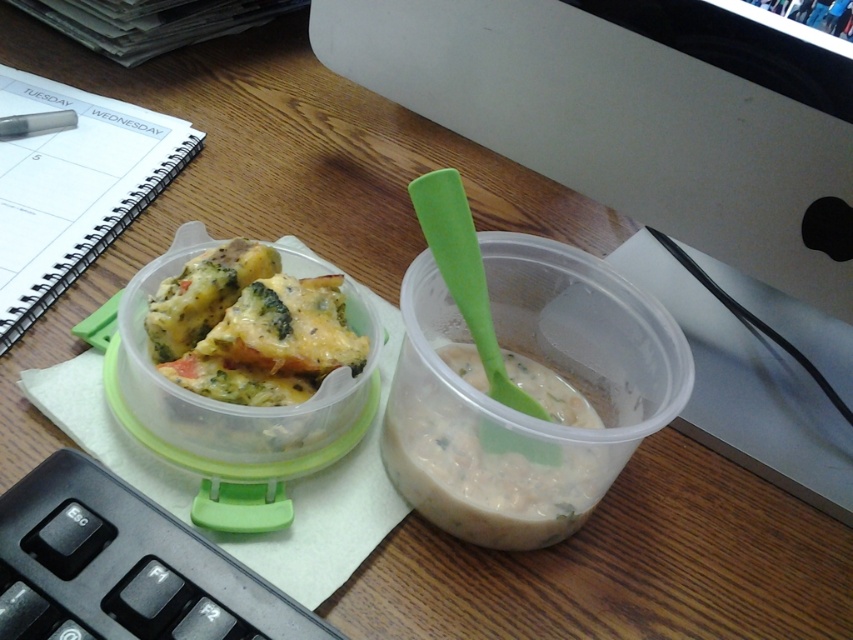
Question: Observing the image, what is the correct spatial positioning of black plastic keyboard at lower left in reference to white creamy soup at center?

Choices:
 (A) left
 (B) right

Answer: (A)

Question: Estimate the real-world distances between objects in this image. Which object is farther from the black plastic keyboard at lower left?

Choices:
 (A) white creamy soup at center
 (B) metallic silver pen at upper left
 (C) cheesy broccoli casserole at left

Answer: (B)

Question: Which object is closer to the camera taking this photo?

Choices:
 (A) metallic silver pen at upper left
 (B) black plastic keyboard at lower left

Answer: (B)

Question: Can you confirm if black plastic keyboard at lower left is positioned below metallic silver pen at upper left?

Choices:
 (A) yes
 (B) no

Answer: (A)

Question: Which object is positioned farthest from the cheesy broccoli casserole at left?

Choices:
 (A) black plastic keyboard at lower left
 (B) white creamy soup at center

Answer: (A)

Question: Does cheesy broccoli casserole at left appear under white creamy soup at center?

Choices:
 (A) no
 (B) yes

Answer: (A)